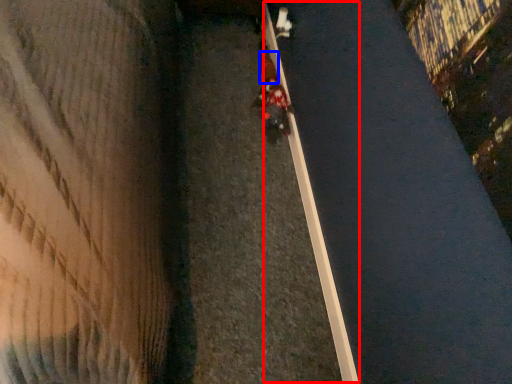
Question: Which of the following is the farthest to the observer, curb (highlighted by a red box) or pedestrian (highlighted by a blue box)?

Choices:
 (A) curb
 (B) pedestrian

Answer: (B)